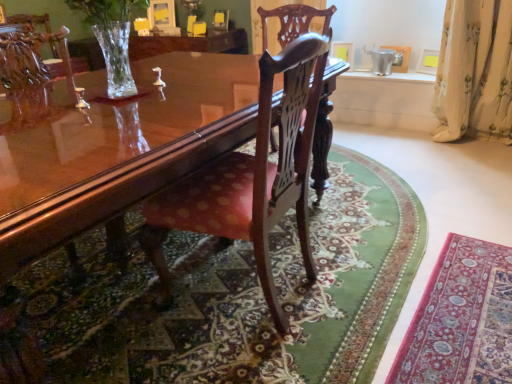
Question: Is point (320, 150) closer or farther from the camera than point (219, 213)?

Choices:
 (A) closer
 (B) farther

Answer: (B)

Question: Considering the positions of polished wood chair at center, the 2th chair in the front-to-back sequence, and polished wood chair at center, the 2th chair from the back, in the image, is polished wood chair at center, the 2th chair in the front-to-back sequence, taller or shorter than polished wood chair at center, the 2th chair from the back,?

Choices:
 (A) short
 (B) tall

Answer: (A)

Question: Which object is the farthest from the glossy wood coffee table at center?

Choices:
 (A) white floral fabric curtain at right
 (B) velvet red rug at lower right
 (C) polished wood chair at center, the 1th chair from the front
 (D) polished wood chair at center, the 2th chair in the front-to-back sequence

Answer: (A)

Question: Which object is the closest to the polished wood chair at center, the 2th chair in the front-to-back sequence?

Choices:
 (A) glossy wood coffee table at center
 (B) velvet red rug at lower right
 (C) polished wood chair at center, the 1th chair from the front
 (D) white floral fabric curtain at right

Answer: (C)